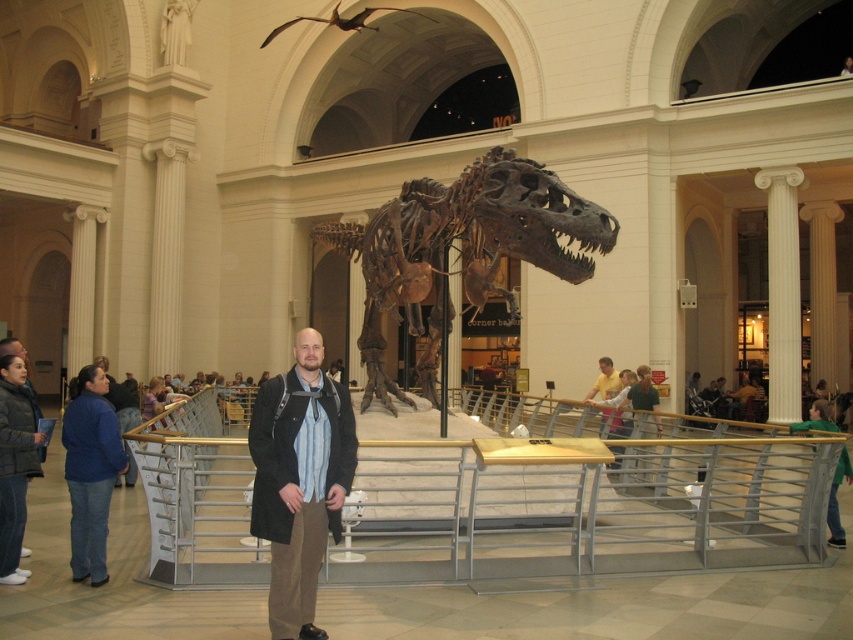
Question: Is rusty metallic dinosaur at center above dark blue puffer jacket at lower left?

Choices:
 (A) yes
 (B) no

Answer: (A)

Question: Considering the real-world distances, which object is farthest from the yellow shirt at center?

Choices:
 (A) blue denim jacket at lower left
 (B) metal/textured rail at center

Answer: (A)

Question: Considering the real-world distances, which object is farthest from the blue denim jacket at lower left?

Choices:
 (A) metal/textured rail at center
 (B) yellow shirt at center
 (C) green fabric jacket at lower right

Answer: (B)

Question: Can you confirm if rusty metallic dinosaur at center is positioned below yellow shirt at center?

Choices:
 (A) yes
 (B) no

Answer: (B)

Question: Does metal/textured rail at center have a larger size compared to yellow shirt at center?

Choices:
 (A) no
 (B) yes

Answer: (B)

Question: Which object appears closest to the camera in this image?

Choices:
 (A) dark brown leather jacket at center
 (B) blue denim jacket at lower left

Answer: (A)